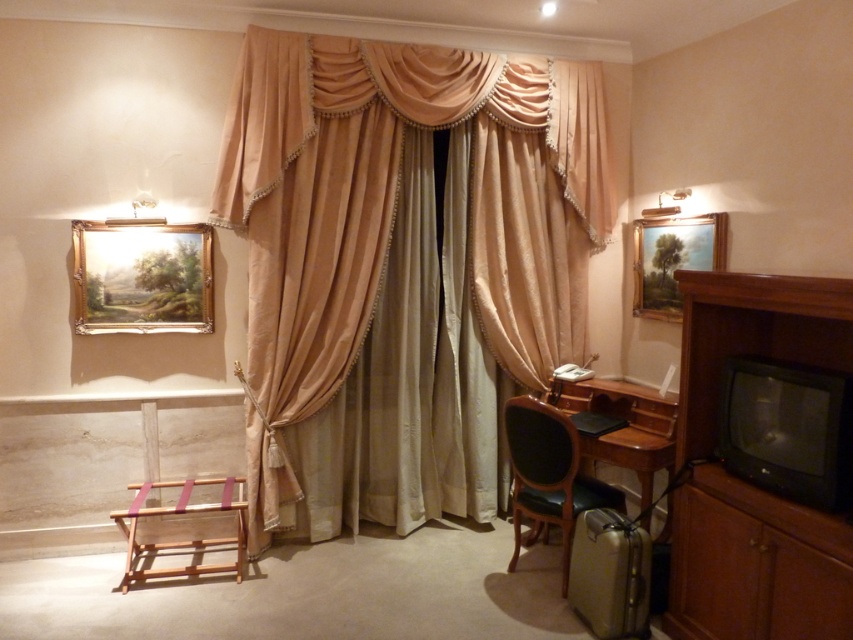
Question: Among these objects, which one is nearest to the camera?

Choices:
 (A) dark green leather chair at lower right
 (B) metallic gold lampshade at upper right
 (C) metallic suitcase at lower right
 (D) brown wood dresser at right

Answer: (D)

Question: Can you confirm if wooden desk at lower right is positioned to the left of wooden stool at lower left?

Choices:
 (A) yes
 (B) no

Answer: (B)

Question: Is silky beige curtains at center smaller than wooden desk at lower right?

Choices:
 (A) no
 (B) yes

Answer: (A)

Question: Which of the following is the closest to the observer?

Choices:
 (A) (662, 209)
 (B) (187, 497)

Answer: (B)

Question: Which object is closer to the camera taking this photo?

Choices:
 (A) brown wood dresser at right
 (B) wooden desk at lower right

Answer: (A)

Question: Does wooden desk at lower right appear on the right side of wooden stool at lower left?

Choices:
 (A) yes
 (B) no

Answer: (A)